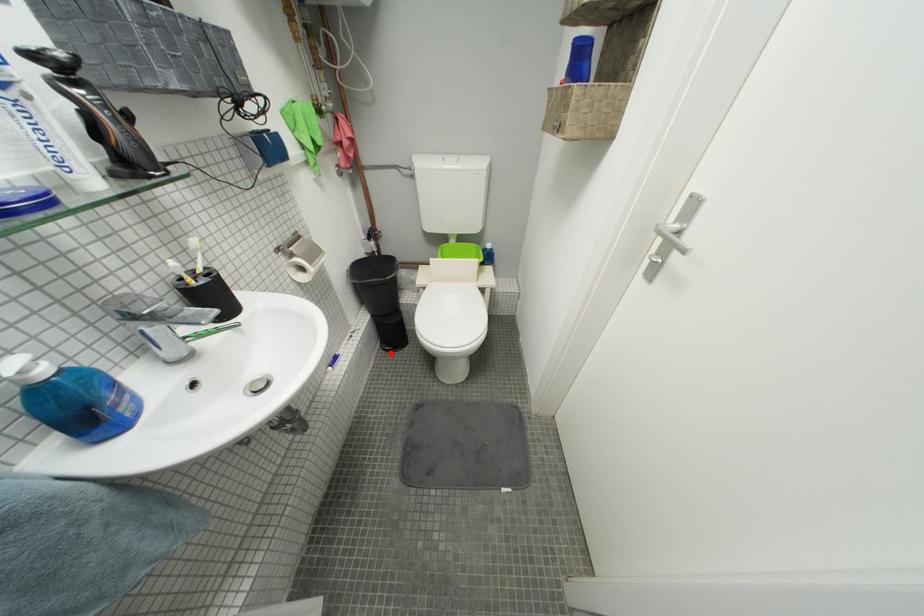
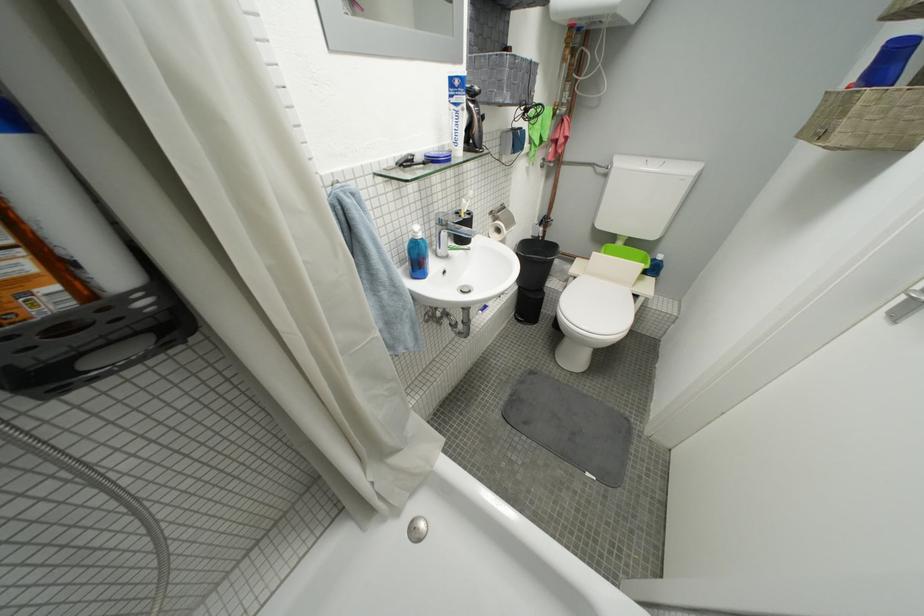
In the second image, find the point that corresponds to the highlighted location in the first image.

(523, 322)